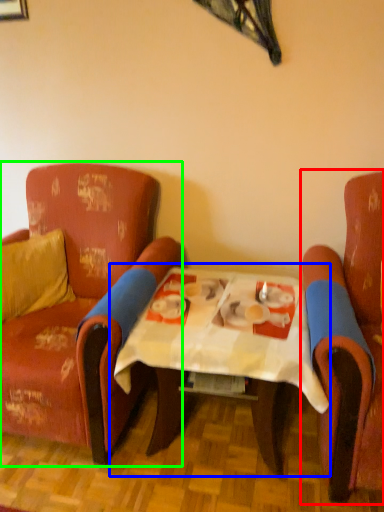
Question: Estimate the real-world distances between objects in this image. Which object is farther from chair (highlighted by a red box), table (highlighted by a blue box) or chair (highlighted by a green box)?

Choices:
 (A) table
 (B) chair

Answer: (B)